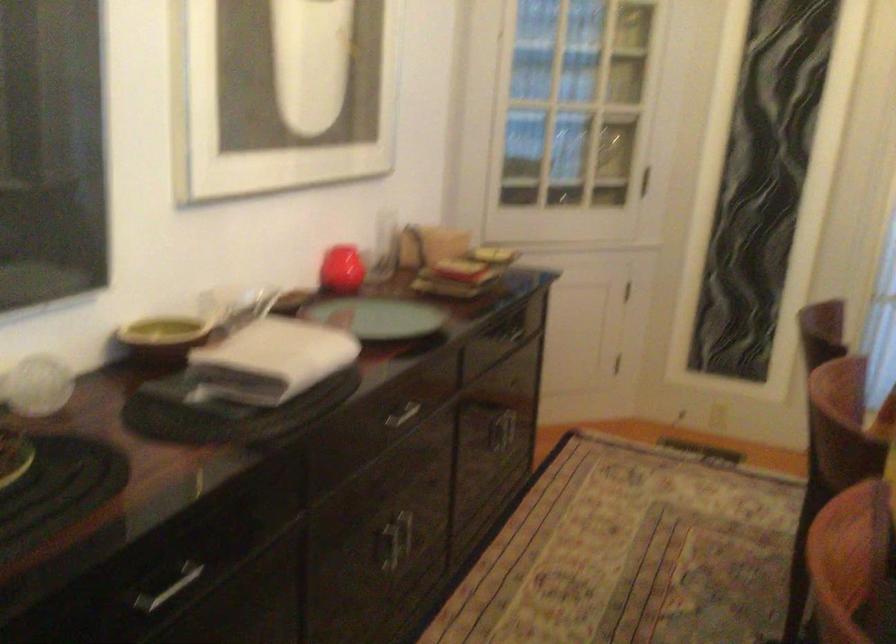
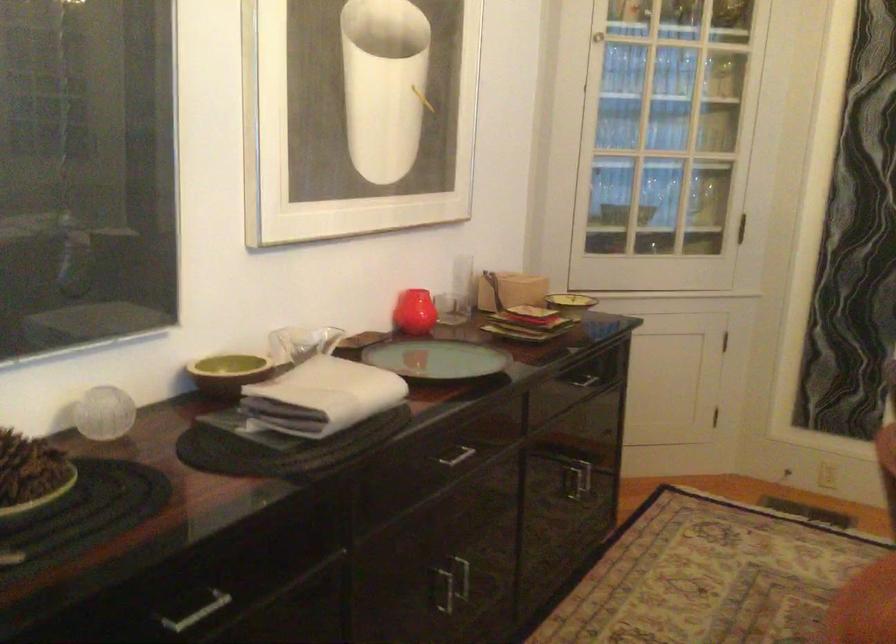
Locate, in the second image, the point that corresponds to [342,268] in the first image.

(414, 312)